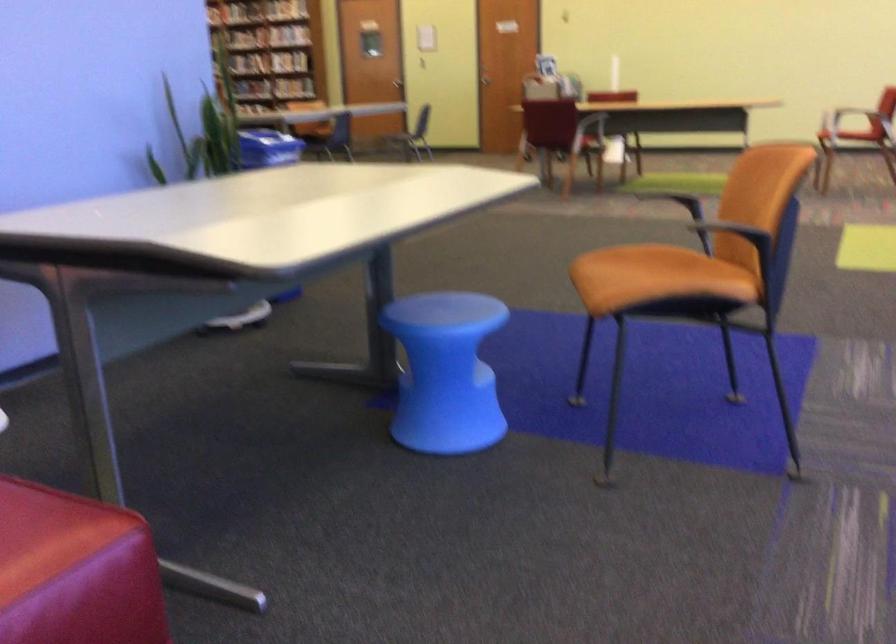
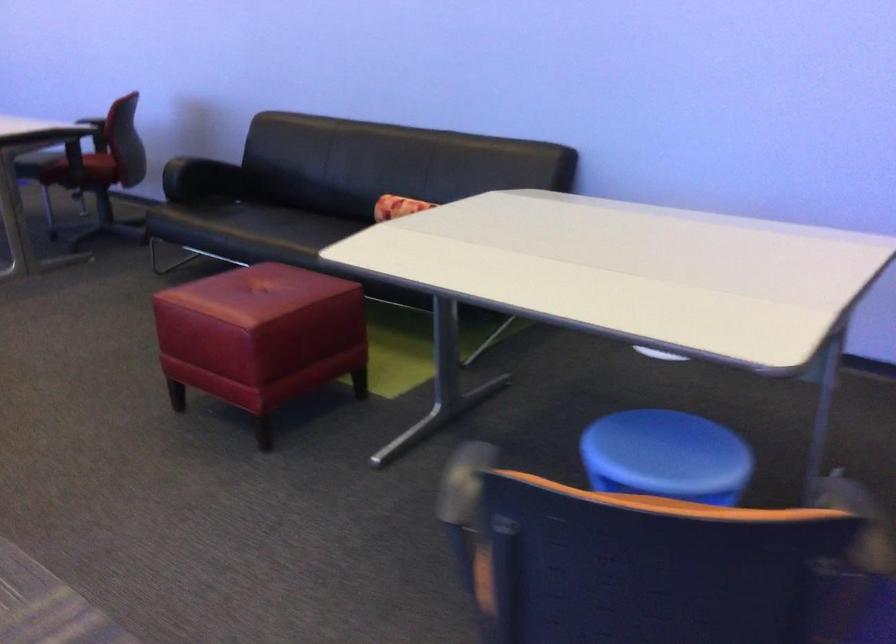
In the second image, find the point that corresponds to (467,306) in the first image.

(666, 456)